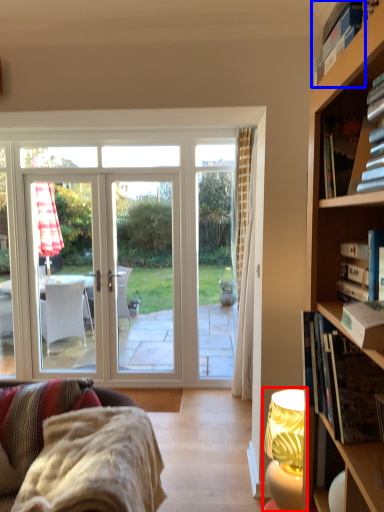
Question: Which of the following is the closest to the observer, lamp (highlighted by a red box) or book (highlighted by a blue box)?

Choices:
 (A) lamp
 (B) book

Answer: (B)